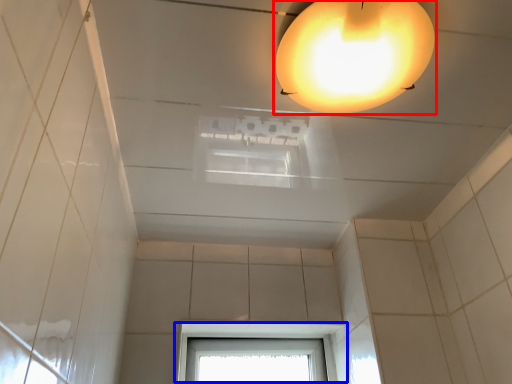
Question: Which object appears farthest to the camera in this image, lamp (highlighted by a red box) or window (highlighted by a blue box)?

Choices:
 (A) lamp
 (B) window

Answer: (B)